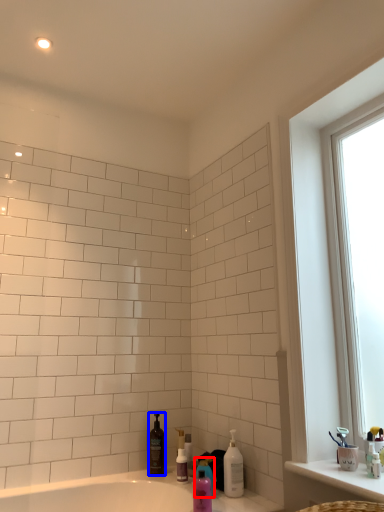
Question: Which of the following is the closest to the observer, cleaning product (highlighted by a red box) or cleaning product (highlighted by a blue box)?

Choices:
 (A) cleaning product
 (B) cleaning product

Answer: (A)